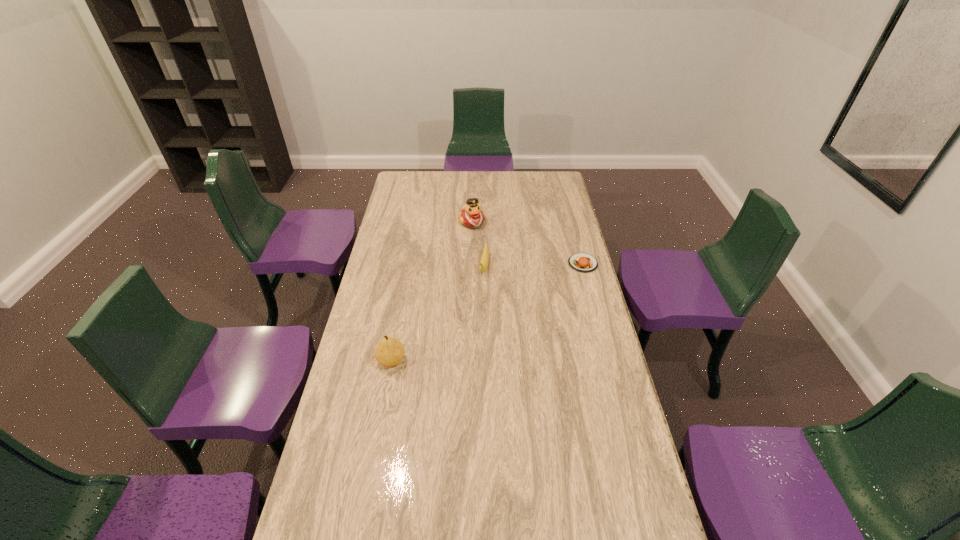
At what (x,y) coordinates should I click in order to perform the action: click on pear. Please return your answer as a coordinate pair (x, y). Image resolution: width=960 pixels, height=540 pixels. Looking at the image, I should click on (389, 352).

Locate an element on the screen. the nearest object is located at coordinates (389, 352).

What are the coordinates of `the rightmost object` in the screenshot? It's located at (581, 262).

Where is `the shortest object`? the shortest object is located at coordinates (581, 262).

The height and width of the screenshot is (540, 960). I want to click on the second shortest object, so click(484, 261).

You are a GUI agent. You are given a task and a screenshot of the screen. Output one action in this format:
    pyautogui.click(x=<x>, y=<y>)
    Task: Click on the farthest object
    The height and width of the screenshot is (540, 960).
    Given the screenshot: What is the action you would take?
    pyautogui.click(x=471, y=215)

Image resolution: width=960 pixels, height=540 pixels. I want to click on vacant space situated on the left of the nearest object, so click(359, 360).

I want to click on vacant space situated 0.400m on the left of the shortest object, so click(474, 264).

Image resolution: width=960 pixels, height=540 pixels. What are the coordinates of `free space located 0.120m at the stem of the banana` in the screenshot? It's located at (480, 302).

At what (x,y) coordinates should I click in order to perform the action: click on free space located 0.330m at the stem of the banana. Please return your answer as a coordinate pair (x, y). This screenshot has width=960, height=540. Looking at the image, I should click on (472, 345).